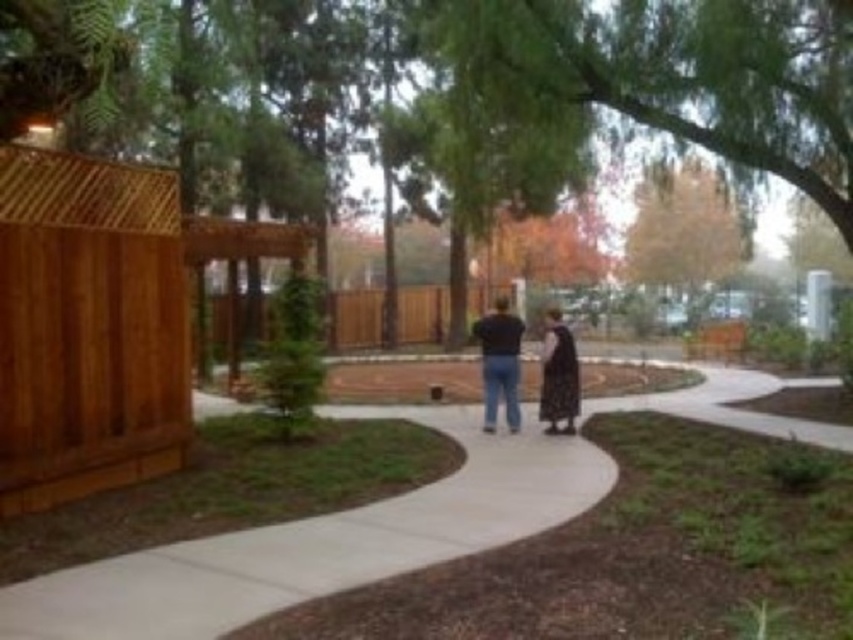
Consider the image. You are standing at the starting point of the curved concrete pathway in the foreground. There is a wooden structure partially visible on the left side. A point at coordinates (x=691, y=182) is 34.11 meters away from you. If you want to reach that point, which direction should you walk relative to the wooden structure?

The point at coordinates (x=691, y=182) is 34.11 meters away from the viewer. To reach it, you should walk towards the wooden structure on the left side since the point is located in that direction.

You are standing at the camera position and want to walk to both the point at coordinates point (280, 579) and point (695, 186). Which point should you reach first?

You should reach point (280, 579) first because it is closer to the camera than point (695, 186).